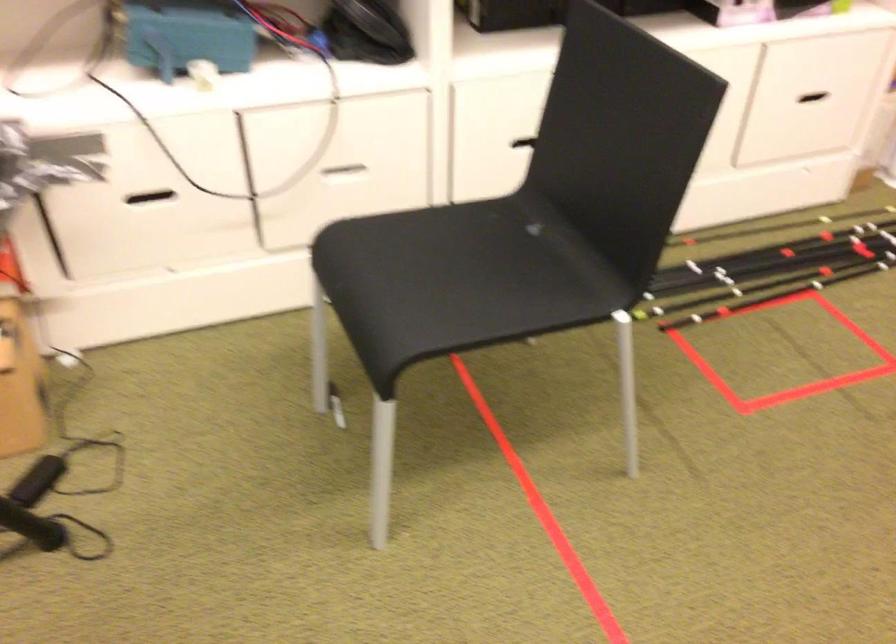
Locate an element on the screen. The height and width of the screenshot is (644, 896). chair sitting surface is located at coordinates click(486, 270).